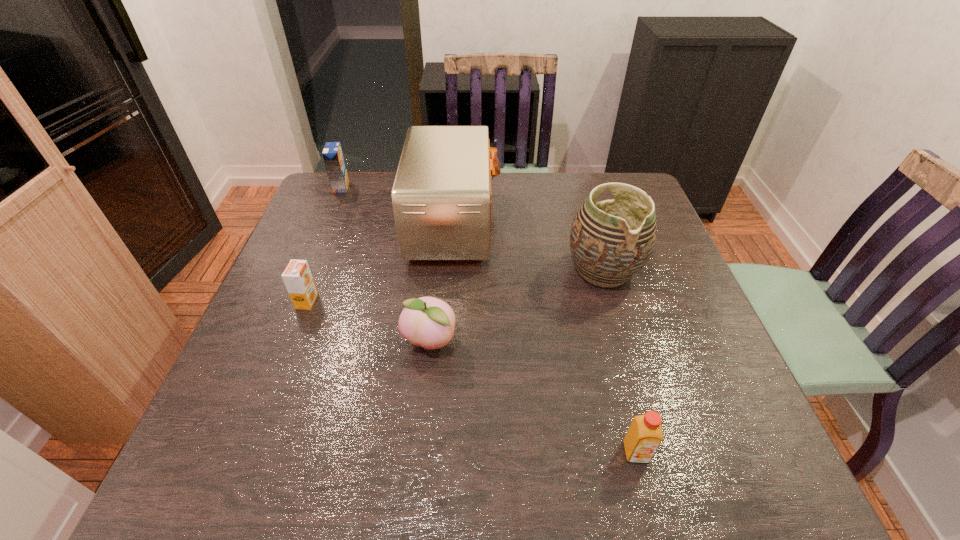
Locate an element on the screen. The height and width of the screenshot is (540, 960). object that is the third closest one to the farthest orange juice is located at coordinates (429, 322).

I want to click on object identified as the third closest to the nearest orange juice, so click(441, 197).

This screenshot has width=960, height=540. Identify the location of orange juice that is the third closest to the fifth farthest object. (332, 153).

Locate which orange juice is the closest to the farthest orange juice. Please provide its 2D coordinates. Your answer should be formatted as a tuple, i.e. [(x, y)], where the tuple contains the x and y coordinates of a point satisfying the conditions above.

[(297, 277)]

Find the location of `vacant space that satisfies the following two spatial constraints: 1. on the back side of the pottery; 2. on the door side of the toaster oven`. vacant space that satisfies the following two spatial constraints: 1. on the back side of the pottery; 2. on the door side of the toaster oven is located at coordinates (589, 225).

Locate an element on the screen. free space that satisfies the following two spatial constraints: 1. on the front side of the farthest orange juice; 2. on the left side of the fifth farthest object is located at coordinates coord(277,342).

This screenshot has width=960, height=540. Find the location of `free location that satisfies the following two spatial constraints: 1. on the back side of the fifth farthest object; 2. on the right side of the pottery`. free location that satisfies the following two spatial constraints: 1. on the back side of the fifth farthest object; 2. on the right side of the pottery is located at coordinates click(437, 271).